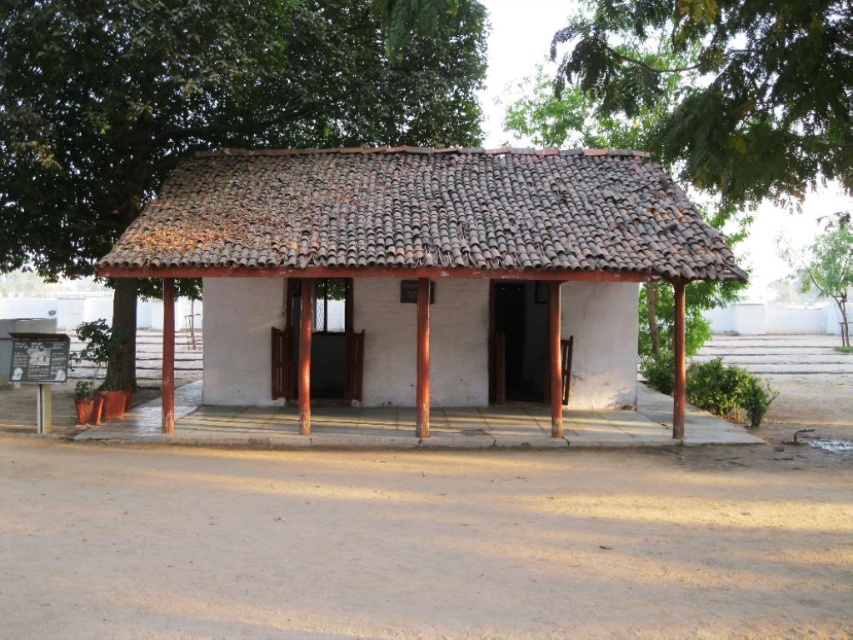
Question: Does brown sandy dirt field at center have a larger size compared to green leafy tree at upper center?

Choices:
 (A) no
 (B) yes

Answer: (A)

Question: Is brown tile roof at center thinner than green leafy tree at upper center?

Choices:
 (A) no
 (B) yes

Answer: (A)

Question: Does green leafy tree at upper left appear on the left side of brown tile roof at center?

Choices:
 (A) no
 (B) yes

Answer: (B)

Question: Which of the following is the closest to the observer?

Choices:
 (A) brown tile roof at center
 (B) green leafy tree at upper right
 (C) green leafy tree at upper left
 (D) green leafy tree at upper center

Answer: (D)

Question: Which object appears farthest from the camera in this image?

Choices:
 (A) green leafy tree at upper left
 (B) green leafy tree at upper right

Answer: (B)

Question: Which object appears closest to the camera in this image?

Choices:
 (A) green leafy tree at upper center
 (B) white matte hut at center
 (C) brown sandy dirt field at center

Answer: (C)